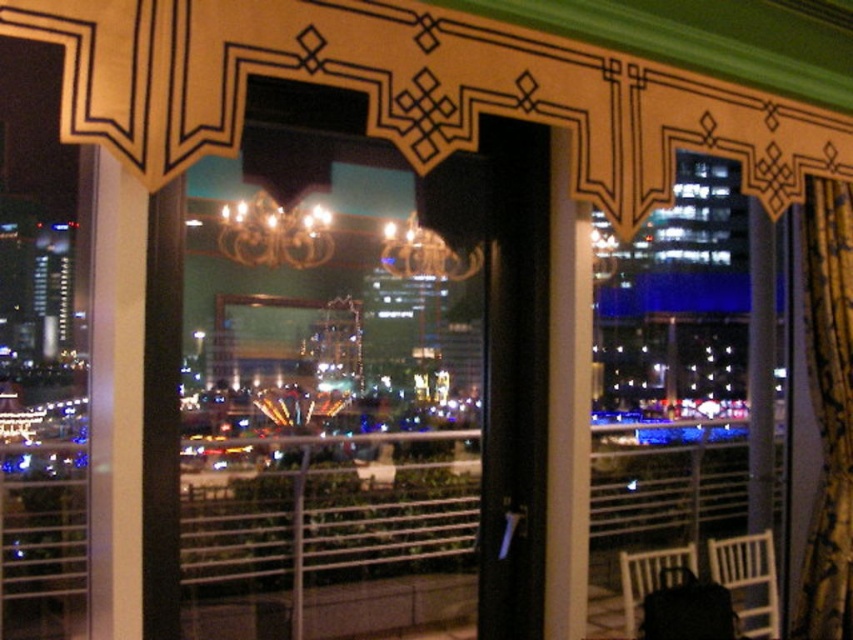
Question: Which object is the closest to the gold metallic chandelier at upper center?

Choices:
 (A) gold metallic chandelier at center
 (B) gold textured curtain at right

Answer: (A)

Question: Is gold textured curtain at right closer to the viewer compared to gold metallic chandelier at upper center?

Choices:
 (A) no
 (B) yes

Answer: (A)

Question: Among these points, which one is farthest from the camera?

Choices:
 (A) (437, 236)
 (B) (222, 230)
 (C) (827, 472)

Answer: (C)

Question: Which of these objects is positioned farthest from the gold metallic chandelier at upper center?

Choices:
 (A) gold textured curtain at right
 (B) gold metallic chandelier at center

Answer: (A)

Question: Is gold metallic chandelier at upper center thinner than gold metallic chandelier at center?

Choices:
 (A) yes
 (B) no

Answer: (A)

Question: Can you confirm if gold textured curtain at right is bigger than gold metallic chandelier at upper center?

Choices:
 (A) yes
 (B) no

Answer: (A)